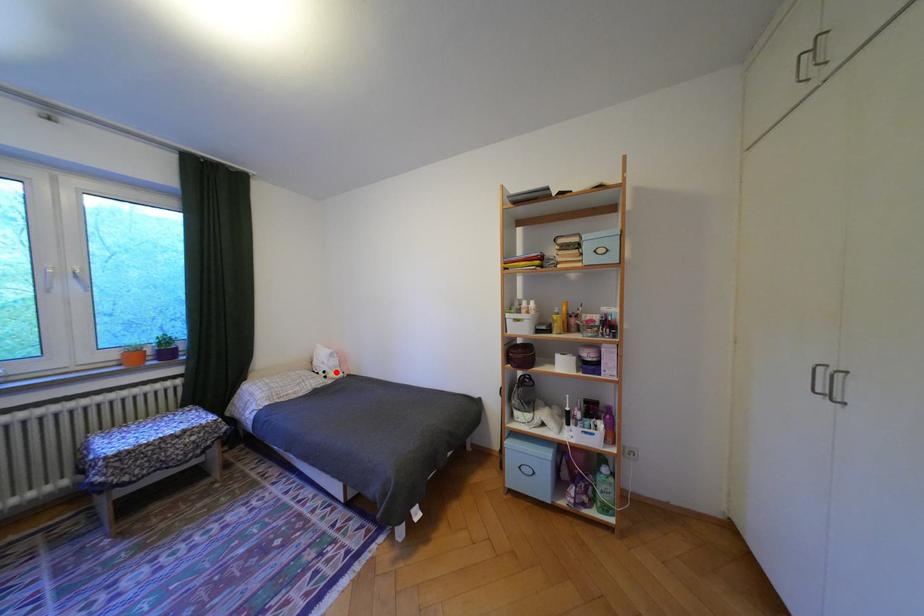
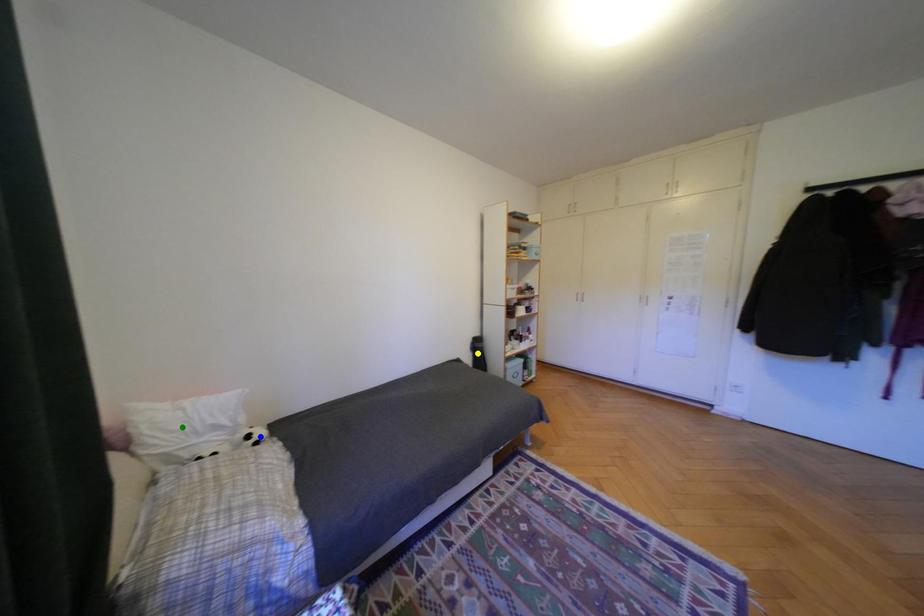
Question: I am providing you with two images of the same scene from different viewpoints. A red point is marked on the first image. You are given multiple points on the second image. Which point in image 2 is actually the same real-world point as the red point in image 1?

Choices:
 (A) green point
 (B) blue point
 (C) yellow point

Answer: (B)